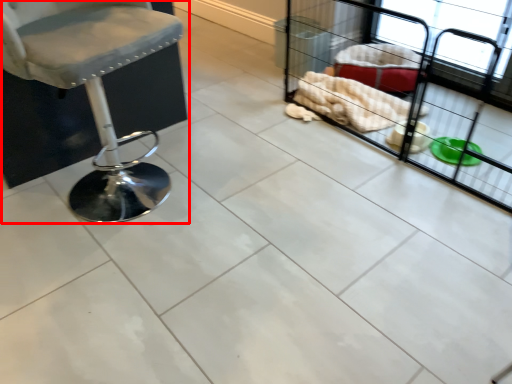
Question: From the image's perspective, what is the correct spatial relationship of chair (annotated by the red box) in relation to baby carriage?

Choices:
 (A) above
 (B) below

Answer: (B)